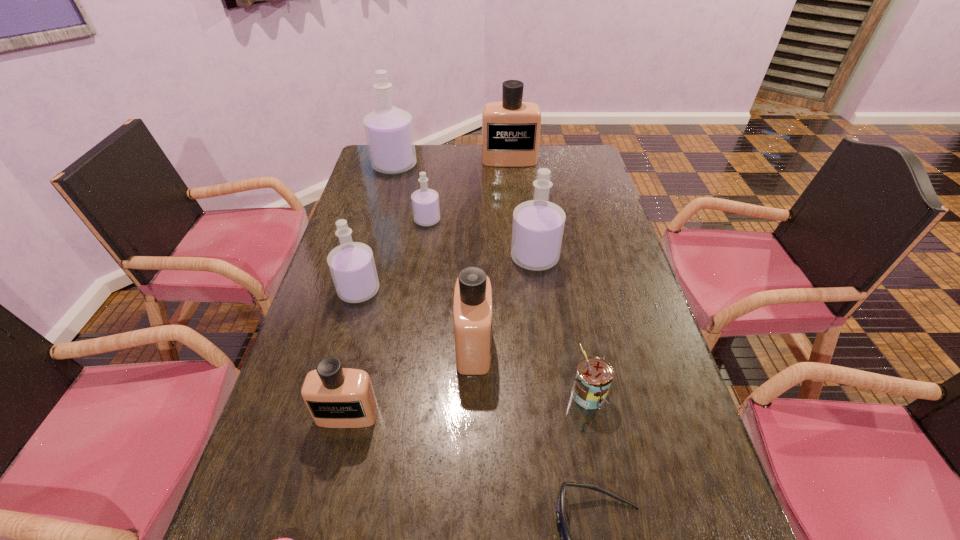
At what (x,y) coordinates should I click in order to perform the action: click on free spot located 0.180m on the front label of the nearest perfume. Please return your answer as a coordinate pair (x, y). Looking at the image, I should click on (323, 521).

You are a GUI agent. You are given a task and a screenshot of the screen. Output one action in this format:
    pyautogui.click(x=<x>, y=<y>)
    Task: Click on the vacant region located 0.160m on the right of the can
    This screenshot has width=960, height=540.
    Given the screenshot: What is the action you would take?
    pyautogui.click(x=676, y=393)

This screenshot has height=540, width=960. I want to click on object situated at the far left corner, so [x=389, y=132].

Locate an element on the screen. This screenshot has height=540, width=960. vacant region at the far edge is located at coordinates (448, 150).

The width and height of the screenshot is (960, 540). What are the coordinates of `vacant region at the left edge of the desktop` in the screenshot? It's located at (363, 337).

In the image, there is a desktop. Where is `vacant space at the right edge`? The width and height of the screenshot is (960, 540). vacant space at the right edge is located at coordinates point(593,309).

This screenshot has width=960, height=540. Identify the location of vacant space at the far right corner. (589, 161).

Find the location of `vacant space that is in between the second smallest beige perfume and the farthest beige perfume`. vacant space that is in between the second smallest beige perfume and the farthest beige perfume is located at coordinates click(492, 253).

Identify the location of free space between the second biggest beige perfume and the nearest beige perfume. (411, 380).

Locate an element on the screen. free spot between the third nearest purple perfume and the nearest perfume is located at coordinates (387, 318).